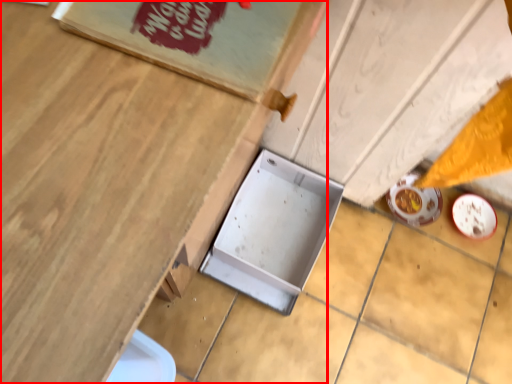
Question: From the image's perspective, what is the correct spatial positioning of table (annotated by the red box) in reference to box?

Choices:
 (A) above
 (B) below

Answer: (A)